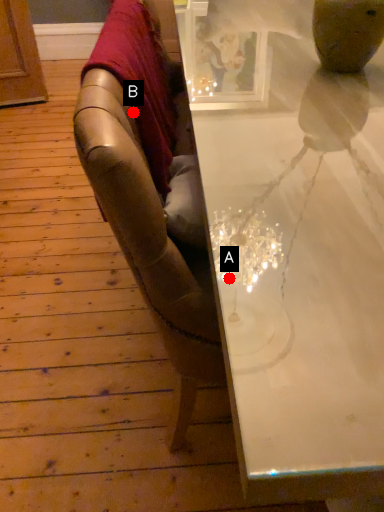
Question: Two points are circled on the image, labeled by A and B beside each circle. Which of the following is the farthest from the observer?

Choices:
 (A) A is further
 (B) B is further

Answer: (B)